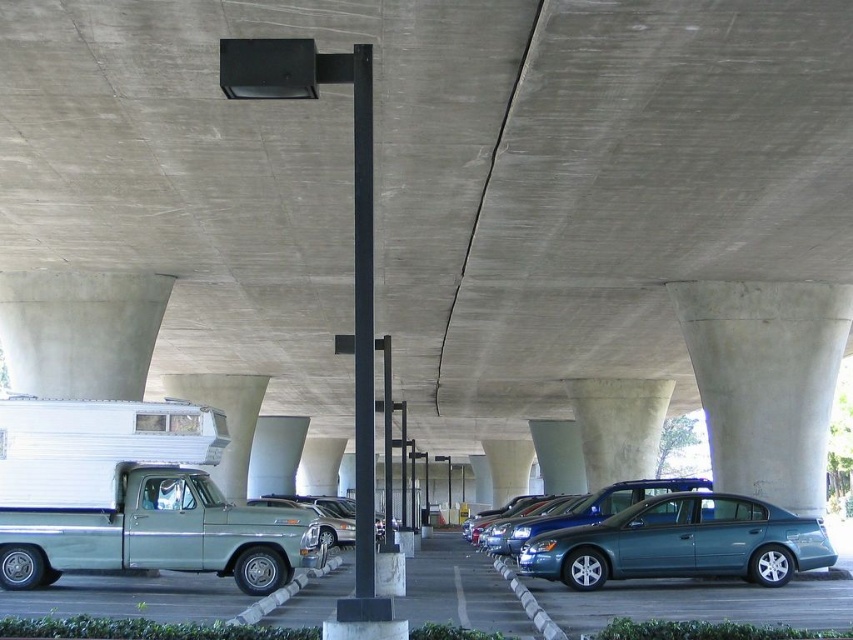
Consider the image. Does teal metallic sedan at center appear over metallic blue sedan at center?

Yes, teal metallic sedan at center is above metallic blue sedan at center.

In order to click on teal metallic sedan at center in this screenshot , I will do `click(682, 541)`.

Image resolution: width=853 pixels, height=640 pixels. Find the location of `teal metallic sedan at center`. teal metallic sedan at center is located at coordinates (682, 541).